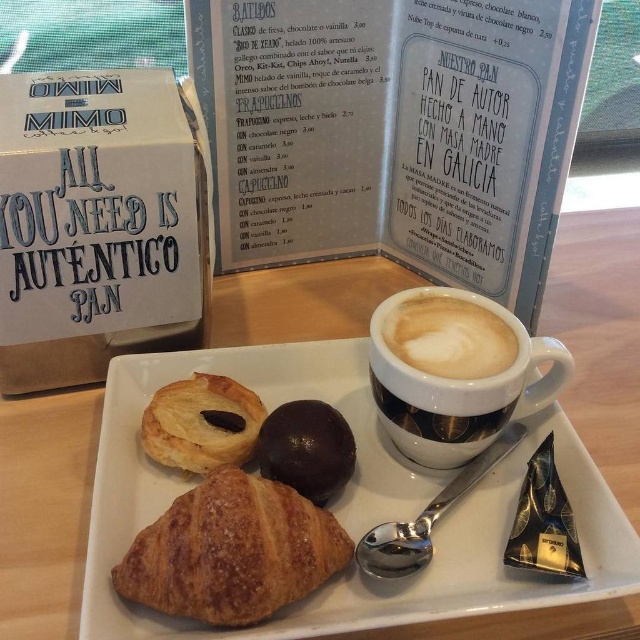
Based on the photo, who is more forward, (49, 93) or (216, 605)?

Point (216, 605) is in front.

You are a GUI agent. You are given a task and a screenshot of the screen. Output one action in this format:
    pyautogui.click(x=<x>, y=<y>)
    Task: Click on the white cardboard box at upper left
    This screenshot has height=640, width=640.
    Given the screenshot: What is the action you would take?
    pyautogui.click(x=99, y=224)

This screenshot has width=640, height=640. I want to click on golden brown croissant at center, so 346,504.

In the scene shown: Does golden brown croissant at center have a greater height compared to golden flaky pastry at center?

Indeed, golden brown croissant at center has a greater height compared to golden flaky pastry at center.

Between point (496, 493) and point (154, 404), which one is positioned in front?

Positioned in front is point (496, 493).

Is point (237, 355) positioned behind point (161, 460)?

Yes.

Locate an element on the screen. Image resolution: width=640 pixels, height=640 pixels. golden brown croissant at center is located at coordinates (346, 504).